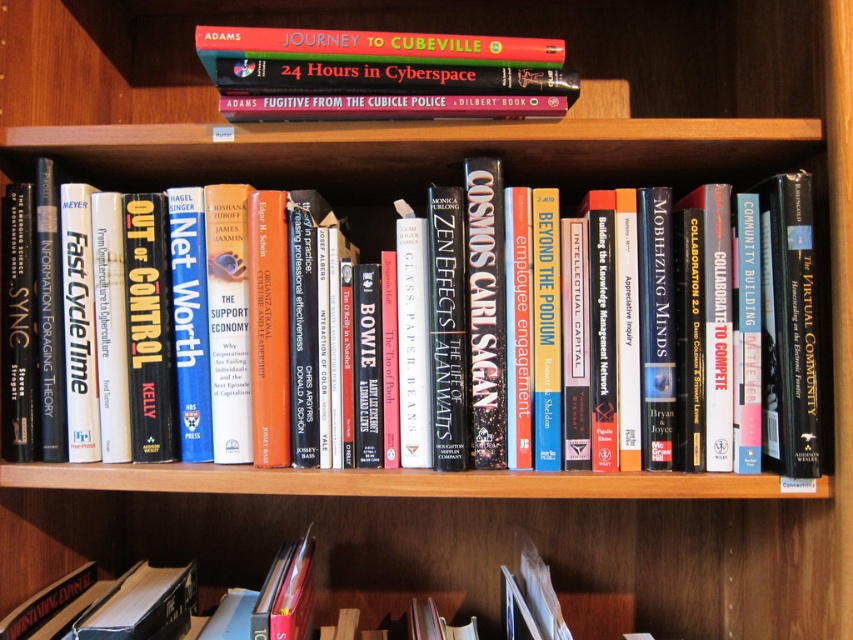
You are standing in front of the bookshelf and want to place a new book between the two points marked as point (526, 160) and point (305, 35). Since the points are coordinates on the bookshelf, can you determine which point is closer to you?

Point (305, 35) is closer to you because it is in front of point (526, 160).

You are organizing a bookshelf and need to place a new book that is 10 cm tall. You have two spots available between the hardcover book at center and the hardcover book at upper center. Which spot would be suitable for the new book?

The new book that is 10 cm tall can be placed between the hardcover book at upper center and the hardcover book at center because the hardcover book at center is taller than the hardcover book at upper center, so the space between them is at least as tall as the shorter book. Since the new book is 10 cm tall, it can fit there if the available space is sufficient.